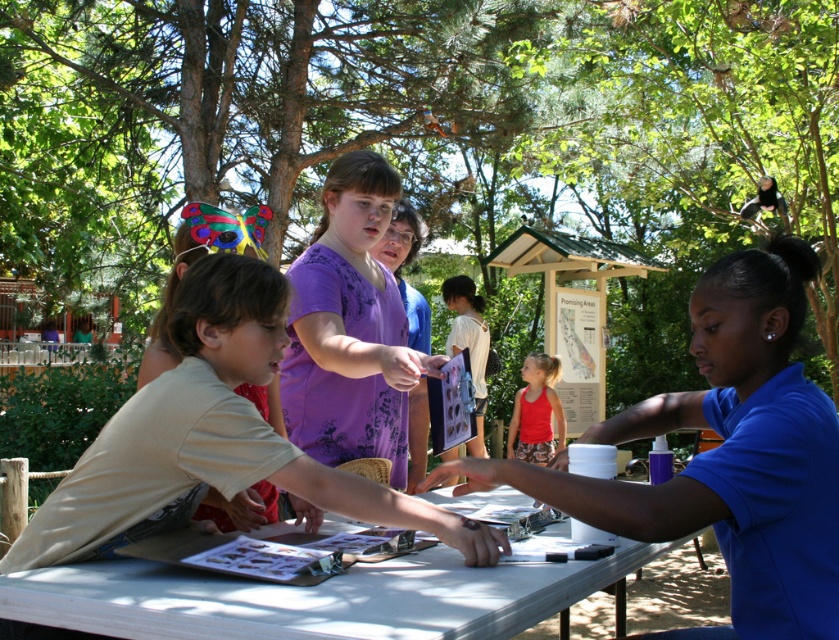
Who is taller, light beige t-shirt at center or white plastic table at center?

Standing taller between the two is light beige t-shirt at center.

From the picture: Can you confirm if light beige t-shirt at center is bigger than white plastic table at center?

Yes, light beige t-shirt at center is bigger than white plastic table at center.

Where is `light beige t-shirt at center`? The width and height of the screenshot is (839, 640). light beige t-shirt at center is located at coordinates (211, 436).

This screenshot has height=640, width=839. I want to click on light beige t-shirt at center, so click(211, 436).

Between blue shirt at center and purple floral shirt at center, which one has less height?

blue shirt at center is shorter.

Identify the location of blue shirt at center. The width and height of the screenshot is (839, 640). (727, 454).

Is point (753, 349) farther from viewer compared to point (214, 356)?

No, (753, 349) is in front of (214, 356).

Locate an element on the screen. blue shirt at center is located at coordinates (727, 454).

Is point (728, 289) more distant than point (249, 316)?

No, (728, 289) is in front of (249, 316).

Find the location of a particular element. The height and width of the screenshot is (640, 839). blue shirt at center is located at coordinates (727, 454).